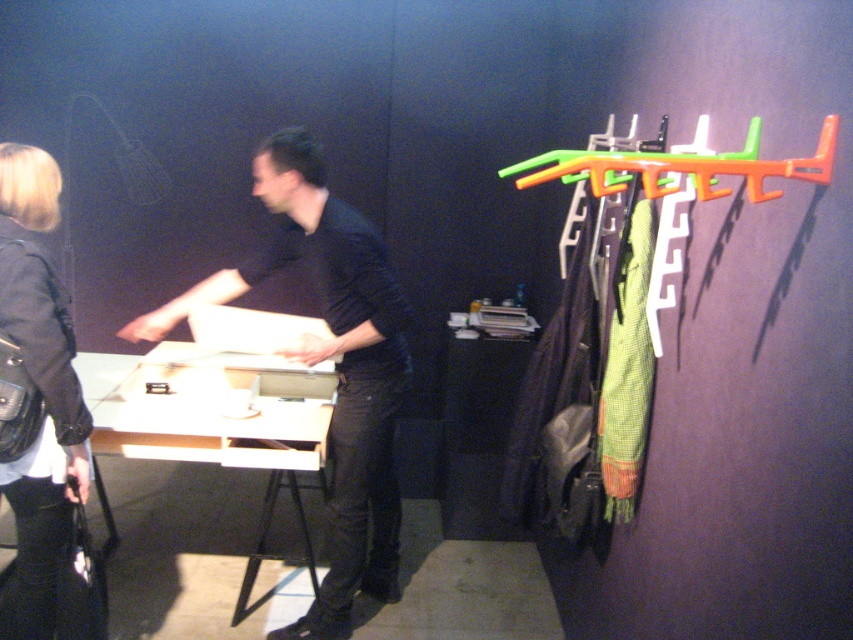
Is matte black shirt at center thinner than black leather jacket at lower left?

No, matte black shirt at center is not thinner than black leather jacket at lower left.

Measure the distance between point (242, 291) and camera.

→ Point (242, 291) and camera are 8.63 feet apart from each other.

I want to click on matte black shirt at center, so click(335, 364).

Is black leather jacket at lower left positioned behind orange plastic hanger at right?

Yes, it is behind orange plastic hanger at right.

Between point (21, 237) and point (750, 134), which one is positioned behind?

The point (21, 237) is behind.

Find the location of a particular element. black leather jacket at lower left is located at coordinates (39, 385).

Who is higher up, white matte table at center or orange plastic hanger at right?

Positioned higher is orange plastic hanger at right.

What do you see at coordinates (212, 428) in the screenshot? This screenshot has height=640, width=853. I see `white matte table at center` at bounding box center [212, 428].

Measure the distance between white matte table at center and camera.

The distance of white matte table at center from camera is 7.68 feet.

The height and width of the screenshot is (640, 853). Find the location of `white matte table at center`. white matte table at center is located at coordinates (212, 428).